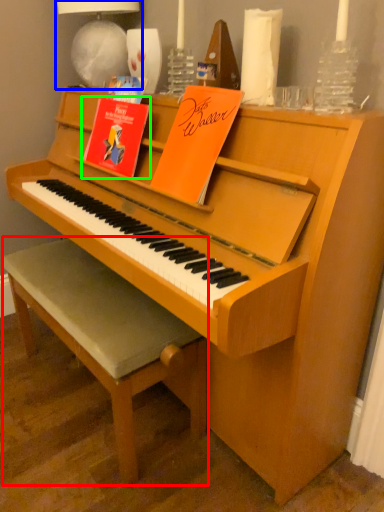
Question: Based on their relative distances, which object is nearer to stool (highlighted by a red box)? Choose from lamp (highlighted by a blue box) and paperback book (highlighted by a green box).

Choices:
 (A) lamp
 (B) paperback book

Answer: (B)